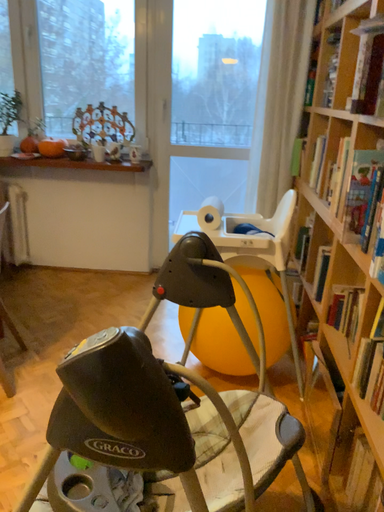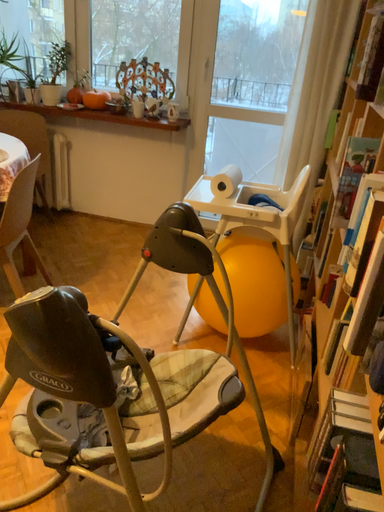
Question: Which way did the camera rotate in the video?

Choices:
 (A) rotated right
 (B) rotated left

Answer: (B)